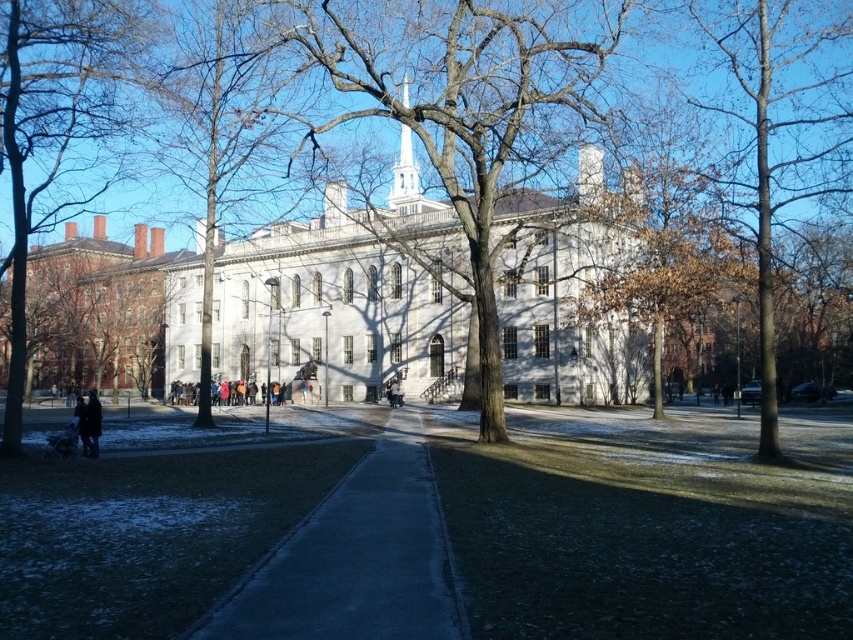
You are standing on the snowy pathway at the university campus and see the bare wood tree at left and the dark blue jacket at lower left. Which object is larger in size?

The bare wood tree at left is bigger than the dark blue jacket at lower left.